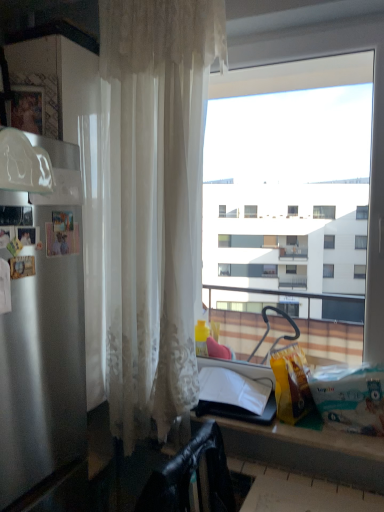
Question: Is black leather chair at lower left wider than sheer white curtain at left?

Choices:
 (A) yes
 (B) no

Answer: (A)

Question: Does black leather chair at lower left touch sheer white curtain at left?

Choices:
 (A) yes
 (B) no

Answer: (B)

Question: From the image's perspective, would you say black leather chair at lower left is shown under sheer white curtain at left?

Choices:
 (A) yes
 (B) no

Answer: (A)

Question: Would you say black leather chair at lower left is outside sheer white curtain at left?

Choices:
 (A) yes
 (B) no

Answer: (A)

Question: Considering the relative sizes of black leather chair at lower left and sheer white curtain at left in the image provided, is black leather chair at lower left smaller than sheer white curtain at left?

Choices:
 (A) yes
 (B) no

Answer: (A)

Question: Considering the relative sizes of black leather chair at lower left and sheer white curtain at left in the image provided, is black leather chair at lower left taller than sheer white curtain at left?

Choices:
 (A) no
 (B) yes

Answer: (A)

Question: Is satin silver refrigerator at left at the left side of black leather chair at lower left?

Choices:
 (A) no
 (B) yes

Answer: (B)

Question: Does satin silver refrigerator at left lie behind black leather chair at lower left?

Choices:
 (A) yes
 (B) no

Answer: (B)

Question: Does satin silver refrigerator at left have a lesser width compared to black leather chair at lower left?

Choices:
 (A) no
 (B) yes

Answer: (A)

Question: Is satin silver refrigerator at left surrounding black leather chair at lower left?

Choices:
 (A) yes
 (B) no

Answer: (B)

Question: Is satin silver refrigerator at left in contact with black leather chair at lower left?

Choices:
 (A) no
 (B) yes

Answer: (A)

Question: From the image's perspective, does satin silver refrigerator at left appear higher than black leather chair at lower left?

Choices:
 (A) yes
 (B) no

Answer: (A)

Question: Can you confirm if satin silver refrigerator at left is thinner than matte black counter at lower center?

Choices:
 (A) no
 (B) yes

Answer: (A)